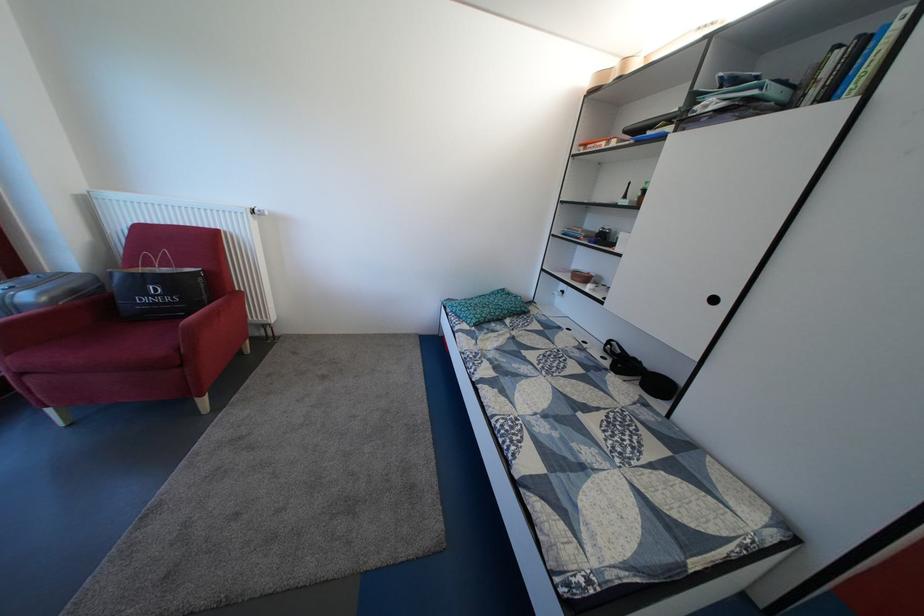
The image size is (924, 616). In order to click on patterned teal pillow in this screenshot , I will do (x=487, y=307).